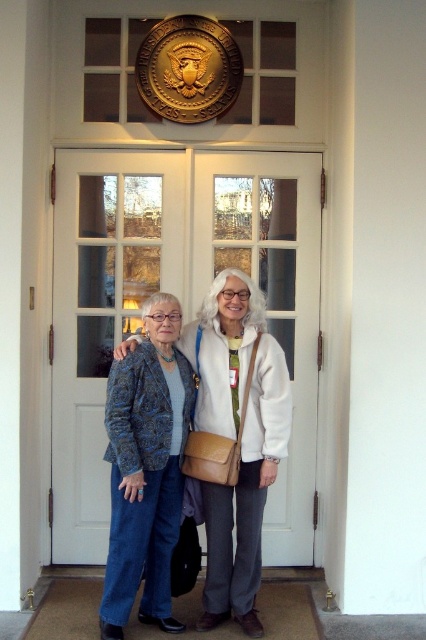
Is point (77, 312) positioned after point (187, 346)?

That is True.

The height and width of the screenshot is (640, 426). Describe the element at coordinates (181, 300) in the screenshot. I see `white glossy door at center` at that location.

Does point (123, 218) come closer to viewer compared to point (287, 385)?

No, (123, 218) is behind (287, 385).

What are the coordinates of `white glossy door at center` in the screenshot? It's located at (181, 300).

Is point (304, 252) farther from viewer compared to point (118, 493)?

That is True.

Between white glossy door at center and blue textured blazer at lower left, which one has less height?

blue textured blazer at lower left

Does point (252, 257) lie in front of point (132, 570)?

No.

The width and height of the screenshot is (426, 640). What are the coordinates of `white glossy door at center` in the screenshot? It's located at (181, 300).

Consider the image. Measure the distance from matte blue jacket at center to blue textured blazer at lower left.

10.77 inches

Which of these two, matte blue jacket at center or blue textured blazer at lower left, stands shorter?

blue textured blazer at lower left is shorter.

Who is more distant from viewer, [227,305] or [164,426]?

Positioned behind is point [227,305].

The width and height of the screenshot is (426, 640). Identify the location of matte blue jacket at center. (236, 438).